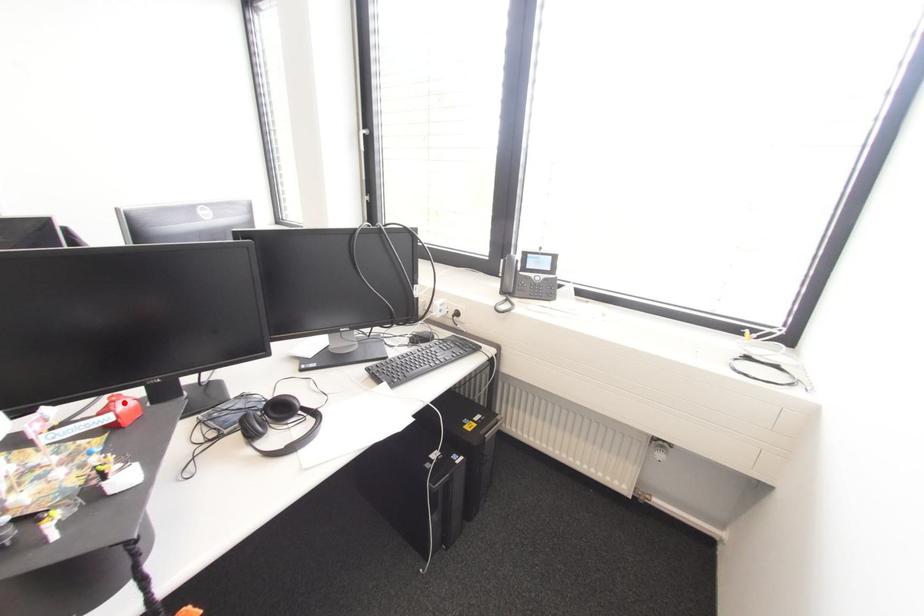
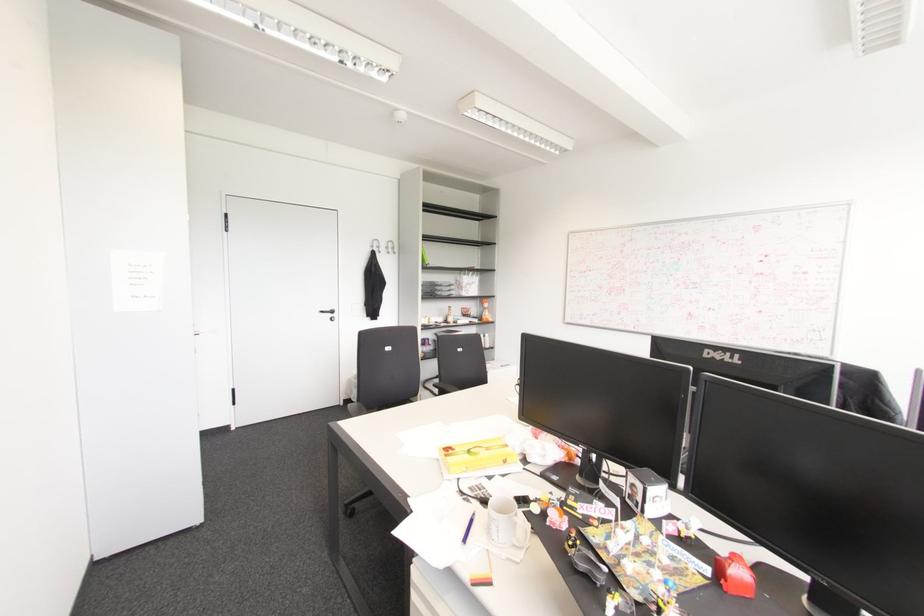
The point at the highlighted location is marked in the first image. Where is the corresponding point in the second image?

(740, 570)